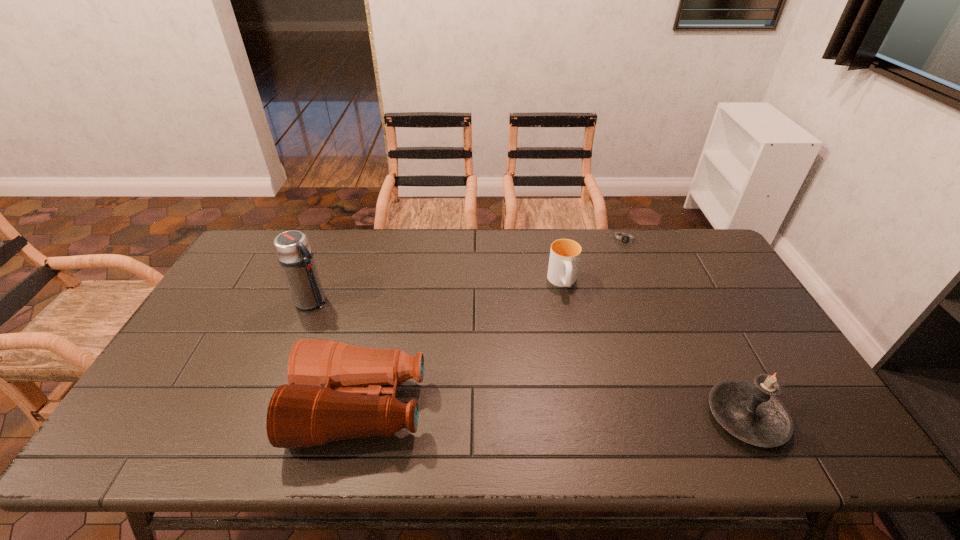
Locate an element on the screen. Image resolution: width=960 pixels, height=540 pixels. the second closest object to the watch is located at coordinates (751, 412).

The height and width of the screenshot is (540, 960). I want to click on object that stands as the fourth closest to the fourth tallest object, so click(292, 248).

Locate an element on the screen. This screenshot has width=960, height=540. blank area in the image that satisfies the following two spatial constraints: 1. on the back side of the cup; 2. on the right side of the tallest object is located at coordinates (321, 282).

Image resolution: width=960 pixels, height=540 pixels. In order to click on free spot that satisfies the following two spatial constraints: 1. on the front side of the fourth shortest object; 2. on the left side of the leftmost object in this screenshot , I will do `click(265, 417)`.

Locate an element on the screen. This screenshot has width=960, height=540. free point that satisfies the following two spatial constraints: 1. on the back side of the watch; 2. on the right side of the third object from right to left is located at coordinates (554, 239).

Locate an element on the screen. free space in the image that satisfies the following two spatial constraints: 1. on the front side of the candle; 2. on the right side of the leftmost object is located at coordinates (265, 417).